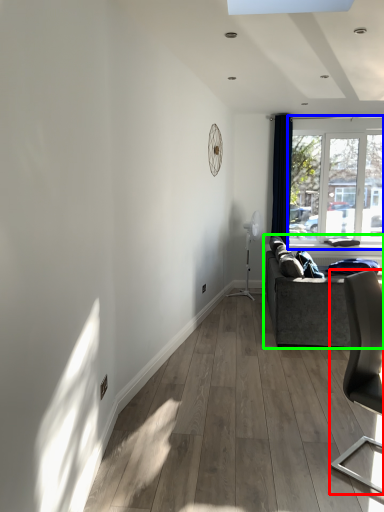
Question: Which object is positioned farthest from chair (highlighted by a red box)? Select from window (highlighted by a blue box) and studio couch (highlighted by a green box).

Choices:
 (A) window
 (B) studio couch

Answer: (A)